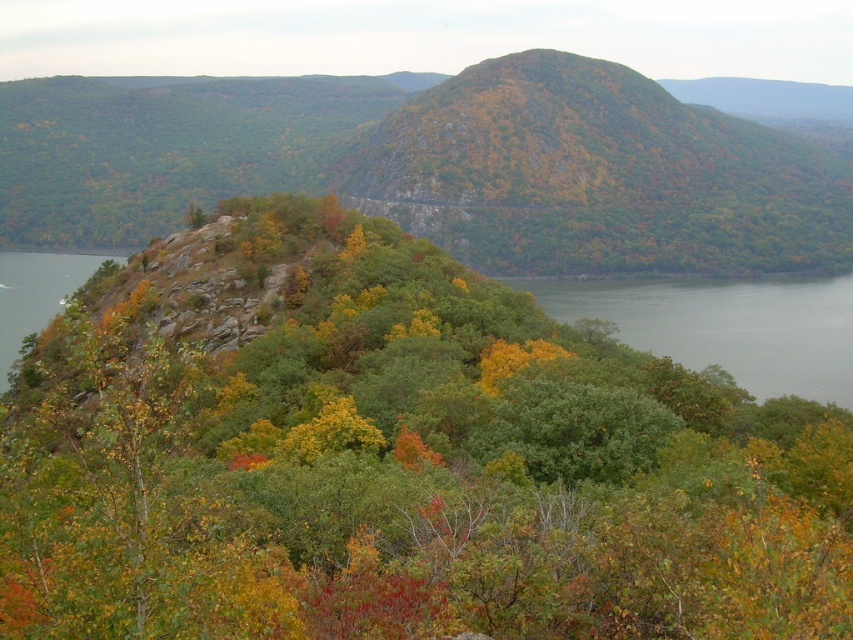
You are planning to cross the water in the image. You have a small boat that can only carry you and your gear. Which part of the water should you choose to navigate through, the gray water at lower right or the green liquid water at left, and why?

You should choose the green liquid water at left because it occupies more space than the gray water at lower right, indicating it might be deeper and safer for navigation with your small boat.

Consider the image. You are standing in the mountainous landscape and want to take a photo of both the green leafy tree at center and the green rocky mountain at center. Which object should you focus on first to ensure both are in clear view?

You should focus on the green leafy tree at center first since it is closer to you than the green rocky mountain at center. By focusing on the closer object, the mountain in the background will also be in focus due to the depth of field.

You are standing at the point labeled point [433,164] in the image. What type of terrain are you currently on?

You are standing on a green rocky mountain at center, as the point [433,164] is located there.